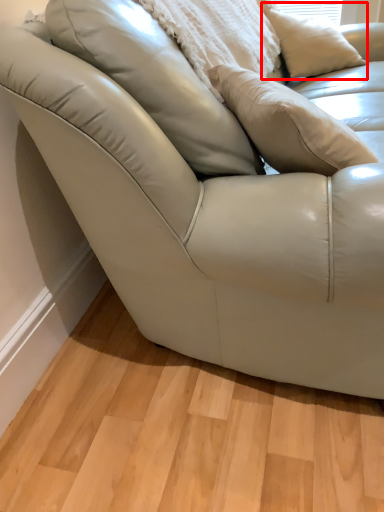
Question: From the image's perspective, where is pillow (annotated by the red box) located relative to pillow?

Choices:
 (A) below
 (B) above

Answer: (B)